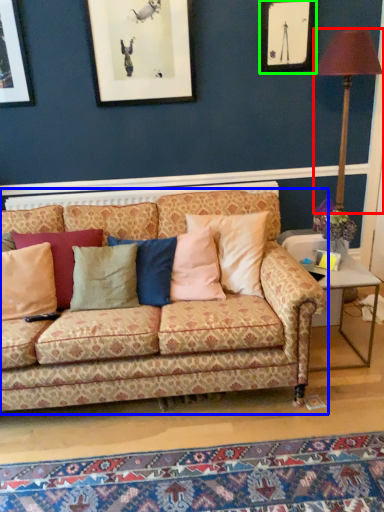
Question: Which object is positioned closest to table lamp (highlighted by a red box)? Select from studio couch (highlighted by a blue box) and picture frame (highlighted by a green box).

Choices:
 (A) studio couch
 (B) picture frame

Answer: (B)